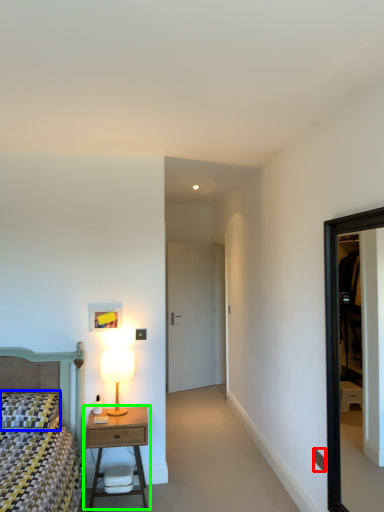
Question: Considering the real-world distances, which object is closest to light switch (highlighted by a red box)? pillow (highlighted by a blue box) or nightstand (highlighted by a green box).

Choices:
 (A) pillow
 (B) nightstand

Answer: (B)